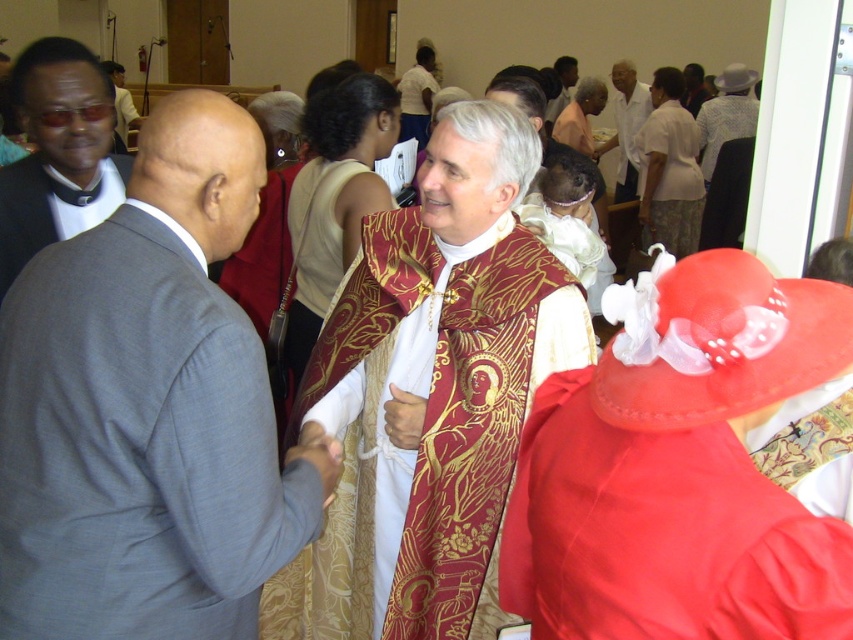
You are standing at point (648,156) and want to walk to the exit located at point (549,333). Is the exit directly in front of you?

Yes, the exit at point (549,333) is directly in front of you because it is positioned in front of your current location at point (648,156).

You are attending a formal event and need to determine which clothing item is wider between the gold embroidered vestment at center and the gold embroidered robe at center. Based on the scene description, which one is wider?

The gold embroidered vestment at center is wider than the gold embroidered robe at center according to the description.

What is the object located at the coordinates point [432,392] in the image?

The object located at point [432,392] is the gold embroidered vestment at center.